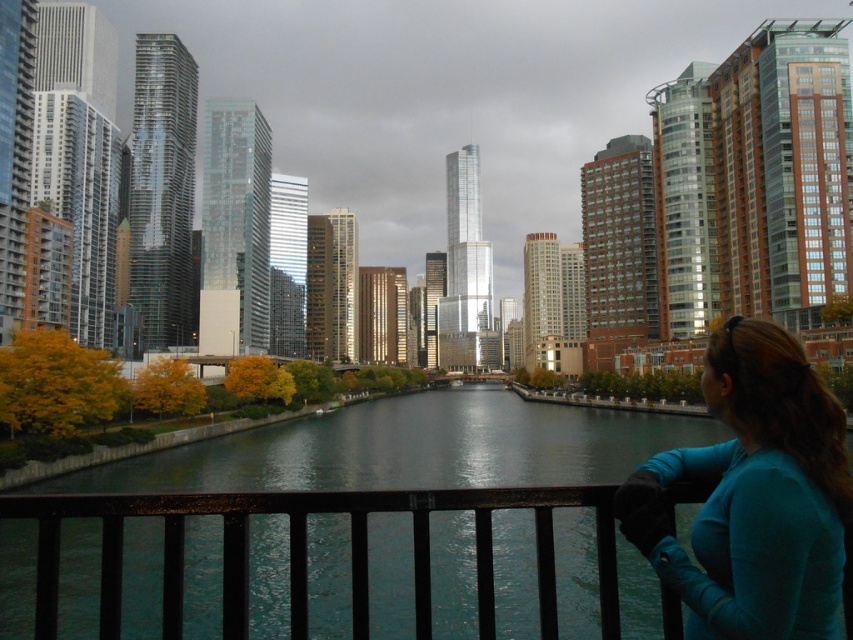
Does point (780, 339) come behind point (49, 508)?

Yes, point (780, 339) is farther from viewer.

Does teal fabric shirt at lower right appear on the right side of metallic black railing at lower center?

Yes, teal fabric shirt at lower right is to the right of metallic black railing at lower center.

What do you see at coordinates (753, 496) in the screenshot?
I see `teal fabric shirt at lower right` at bounding box center [753, 496].

The width and height of the screenshot is (853, 640). In order to click on teal fabric shirt at lower right in this screenshot , I will do `click(753, 496)`.